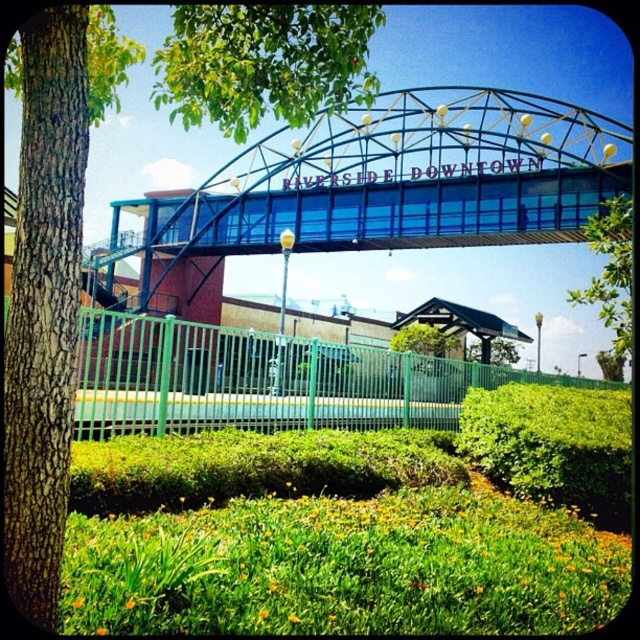
Question: Does blue glass pedestrian bridge at center have a greater width compared to green leafy tree at center?

Choices:
 (A) no
 (B) yes

Answer: (B)

Question: Is blue glass pedestrian bridge at center bigger than green leafy tree at center?

Choices:
 (A) no
 (B) yes

Answer: (B)

Question: Is blue glass pedestrian bridge at center closer to the viewer compared to green leafy tree at center?

Choices:
 (A) yes
 (B) no

Answer: (B)

Question: Which object appears closest to the camera in this image?

Choices:
 (A) green leafy tree at center
 (B) blue glass pedestrian bridge at center

Answer: (A)

Question: Which object appears closest to the camera in this image?

Choices:
 (A) green leafy tree at center
 (B) blue glass pedestrian bridge at center

Answer: (A)